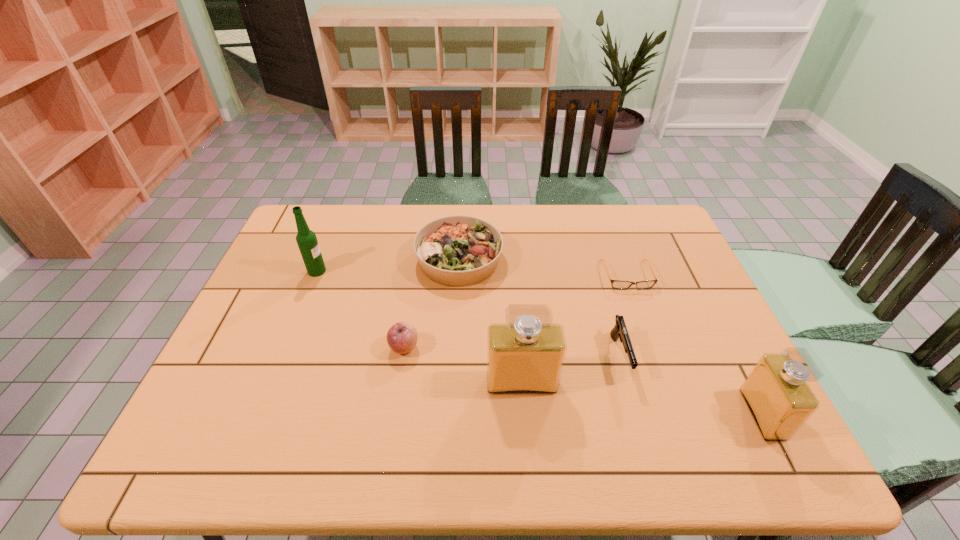
Identify the location of free region located on the front-facing side of the shorter perfume. (723, 414).

Locate an element on the screen. This screenshot has width=960, height=540. vacant space located 0.100m on the front-facing side of the shorter perfume is located at coordinates (705, 414).

I want to click on free region located 0.360m on the front of the salad plate, so [452, 400].

Locate an element on the screen. This screenshot has width=960, height=540. vacant position located on the label of the leftmost object is located at coordinates (346, 271).

The height and width of the screenshot is (540, 960). In order to click on free space located 0.170m on the front-facing side of the shortest object in this screenshot , I will do `click(649, 337)`.

Find the location of `vacant area situated at the aiming end of the third object from right to left`. vacant area situated at the aiming end of the third object from right to left is located at coordinates (636, 411).

Find the location of a particular element. vacant area situated 0.070m on the right of the apple is located at coordinates (446, 348).

The height and width of the screenshot is (540, 960). Identify the location of object at the far edge. (457, 251).

I want to click on object at the left edge, so click(x=306, y=239).

Locate an element on the screen. perfume located in the right edge section of the desktop is located at coordinates (776, 392).